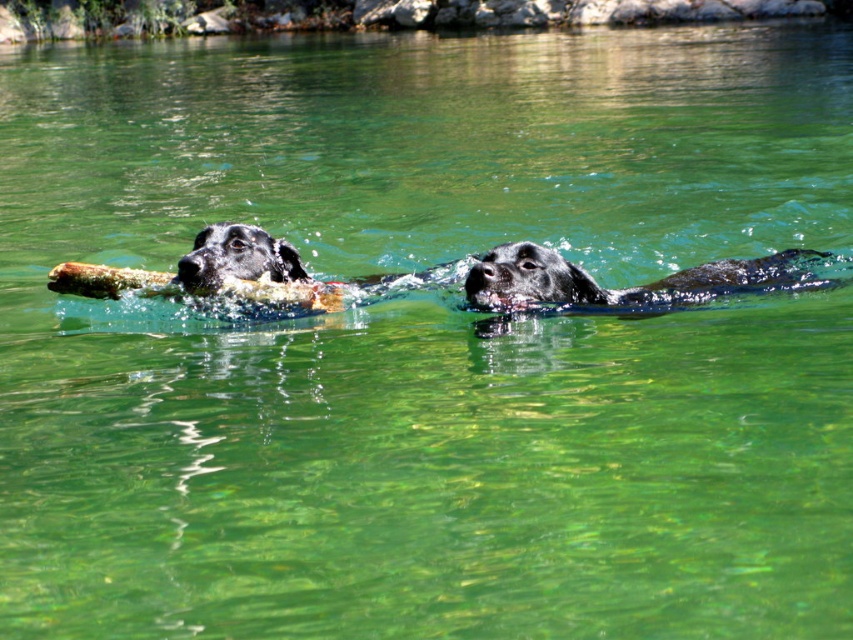
Does point (782, 284) come behind point (215, 240)?

Yes, point (782, 284) is behind point (215, 240).

Does shiny black fur at center appear over black glossy dog at left?

No.

The width and height of the screenshot is (853, 640). What do you see at coordinates (622, 289) in the screenshot? I see `shiny black fur at center` at bounding box center [622, 289].

Find the location of a particular element. shiny black fur at center is located at coordinates (622, 289).